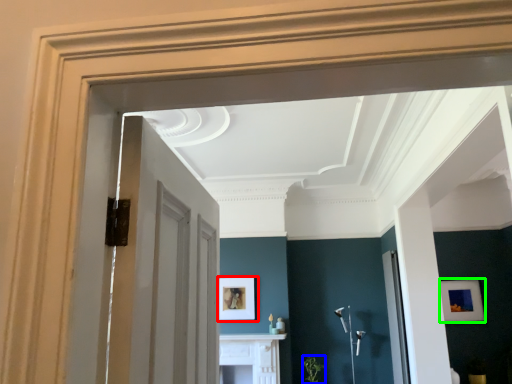
Question: Which is nearer to the picture frame (highlighted by a red box)? plant (highlighted by a blue box) or picture frame (highlighted by a green box).

Choices:
 (A) plant
 (B) picture frame

Answer: (A)